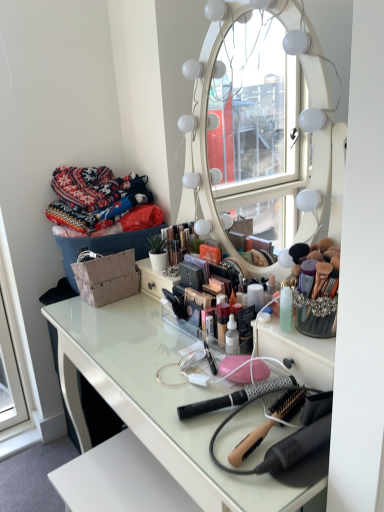
Identify the location of vacant space behind wooden-handled hairbrush at center, which is the 1th brush in front-to-back order. (215, 380).